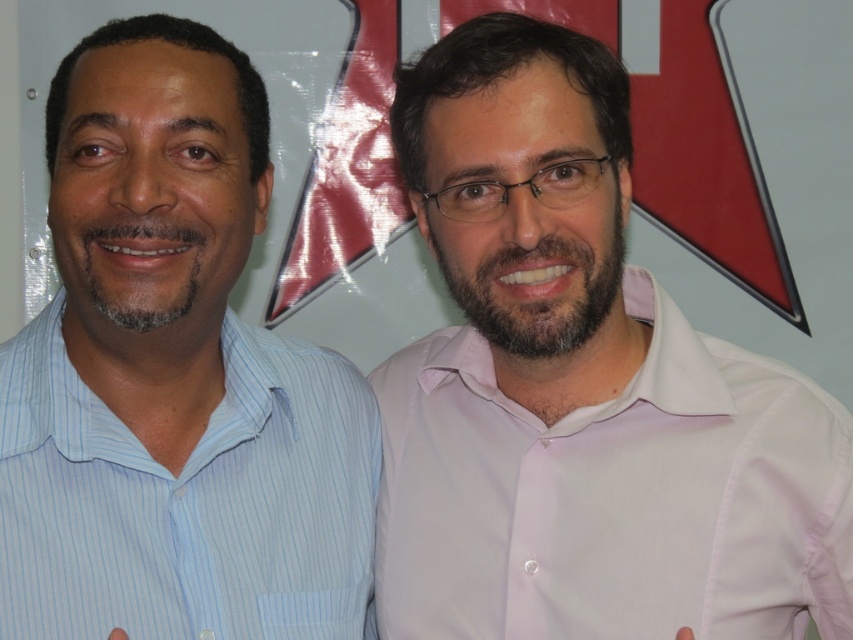
Is point (672, 563) positioned in front of point (340, 600)?

Yes.

This screenshot has width=853, height=640. Describe the element at coordinates (612, 496) in the screenshot. I see `pink smooth shirt at right` at that location.

Where is `pink smooth shirt at right`? Image resolution: width=853 pixels, height=640 pixels. pink smooth shirt at right is located at coordinates (612, 496).